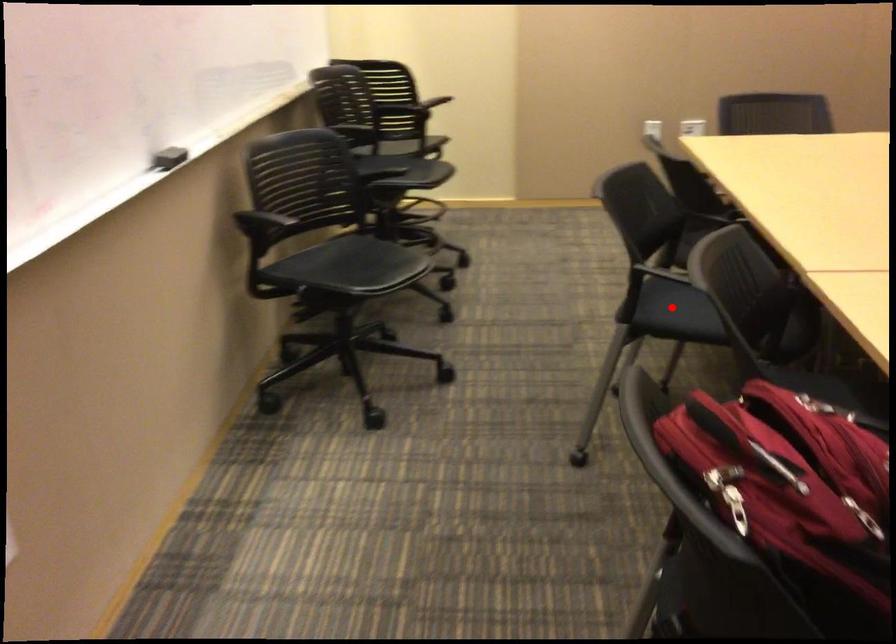
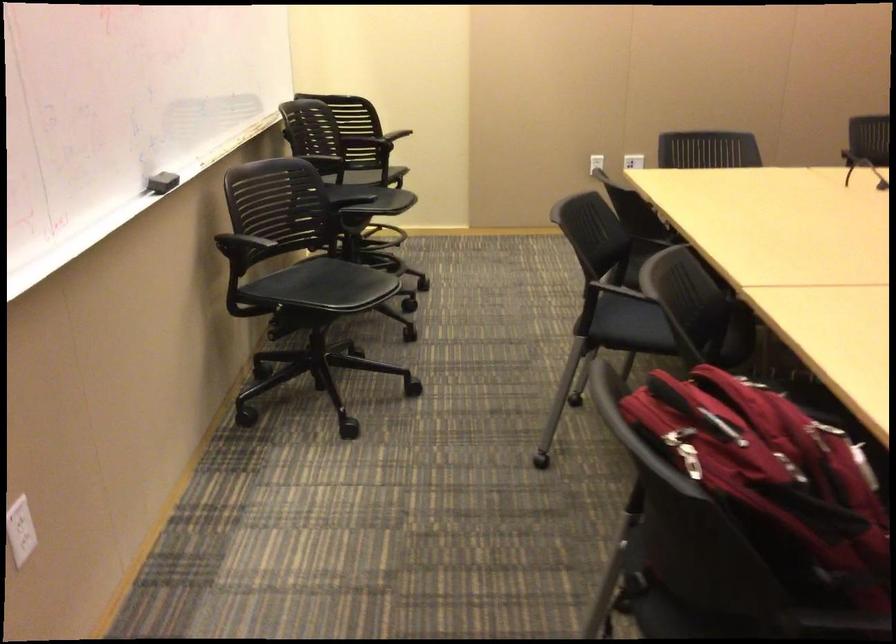
Find the pixel in the second image that matches the highlighted location in the first image.

(629, 324)